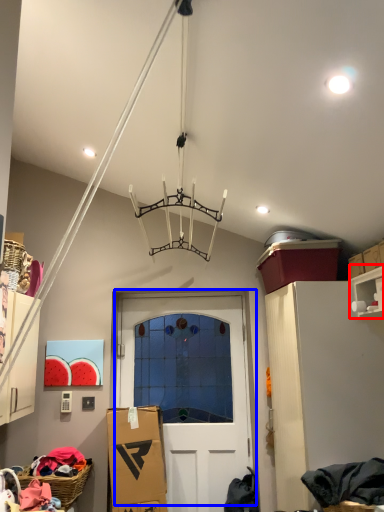
Question: Which point is closer to the camera, shelf (highlighted by a red box) or door (highlighted by a blue box)?

Choices:
 (A) shelf
 (B) door

Answer: (A)